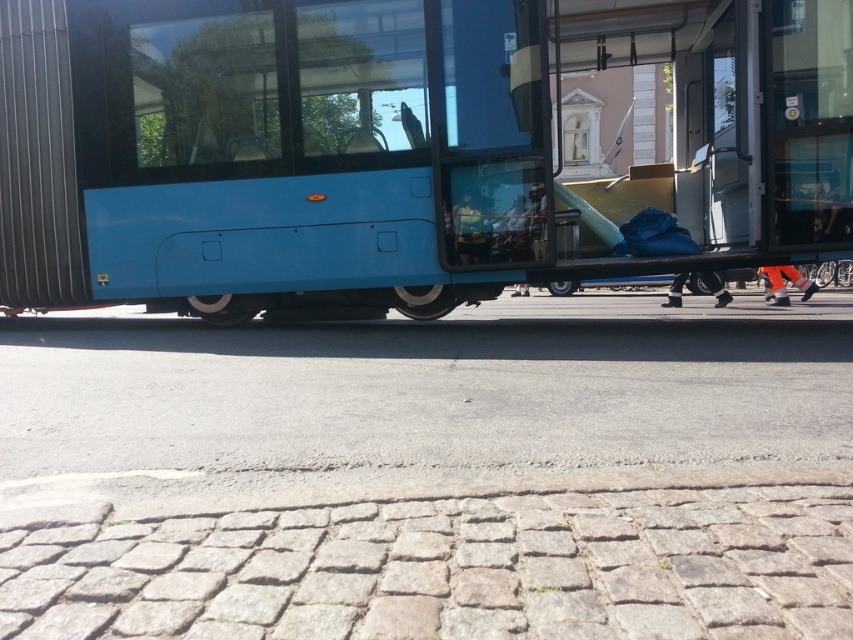
You are standing at the point marked by point (431, 474) on the image. What material are you standing on?

You are standing on gray asphalt at center.

You are a pedestrian standing on the street and see the blue matte bus at center and the orange fabric pants at lower right. Which object is closer to you?

The blue matte bus at center is closer to you because it is positioned in front of the orange fabric pants at lower right.

You are a delivery person with a cart that is 2 meters wide. You need to move from the gray asphalt at center to the blue matte bus at center. Is there enough space between them for your cart to pass through?

The distance between the gray asphalt at center and the blue matte bus at center is 4.70 meters. Since your cart is 2 meters wide, there is sufficient space for it to pass through as the distance is greater than the cart width.